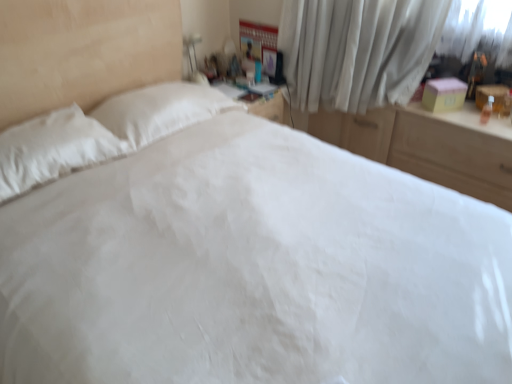
Identify the location of wooden dresser at right. The height and width of the screenshot is (384, 512). (426, 147).

The height and width of the screenshot is (384, 512). What do you see at coordinates (426, 147) in the screenshot? I see `wooden dresser at right` at bounding box center [426, 147].

I want to click on white sheer curtain at upper right, so 358,50.

This screenshot has width=512, height=384. What do you see at coordinates (358, 50) in the screenshot?
I see `white sheer curtain at upper right` at bounding box center [358, 50].

Identify the location of wooden dresser at right. The height and width of the screenshot is (384, 512). (426, 147).

Between white sheer curtain at upper right and wooden dresser at right, which one appears on the left side from the viewer's perspective?

white sheer curtain at upper right.

Is white sheer curtain at upper right closer to camera compared to wooden dresser at right?

No, it is behind wooden dresser at right.

Considering the positions of points (310, 29) and (452, 115), is point (310, 29) closer to camera compared to point (452, 115)?

No, it is not.

From the image's perspective, which one is positioned higher, white sheer curtain at upper right or wooden dresser at right?

white sheer curtain at upper right.

From the picture: From a real-world perspective, is white sheer curtain at upper right on wooden dresser at right?

Yes.

Consider the image. Is white sheer curtain at upper right wider or thinner than wooden dresser at right?

white sheer curtain at upper right is thinner than wooden dresser at right.

Can you confirm if white sheer curtain at upper right is shorter than wooden dresser at right?

No, white sheer curtain at upper right is not shorter than wooden dresser at right.

Between white sheer curtain at upper right and wooden dresser at right, which one has larger size?

Bigger between the two is wooden dresser at right.

From the picture: Is wooden dresser at right located within white sheer curtain at upper right?

That's incorrect, wooden dresser at right is not inside white sheer curtain at upper right.

Is white sheer curtain at upper right not near wooden dresser at right?

Actually, white sheer curtain at upper right and wooden dresser at right are a little close together.

Is white sheer curtain at upper right turned away from wooden dresser at right?

No, white sheer curtain at upper right is not facing the opposite direction of wooden dresser at right.

How different are the orientations of white sheer curtain at upper right and wooden dresser at right in degrees?

There is a 46.9-degree angle between the facing directions of white sheer curtain at upper right and wooden dresser at right.

How far apart are white sheer curtain at upper right and wooden dresser at right?

The distance of white sheer curtain at upper right from wooden dresser at right is 13.13 inches.

Identify the location of curtain on the left of wooden dresser at right. This screenshot has width=512, height=384. (358, 50).

In the image, is wooden dresser at right on the left side or the right side of white sheer curtain at upper right?

Based on their positions, wooden dresser at right is located to the right of white sheer curtain at upper right.

Consider the image. Does wooden dresser at right come behind white sheer curtain at upper right?

No, wooden dresser at right is in front of white sheer curtain at upper right.

Is point (316, 133) positioned behind point (419, 64)?

Yes, point (316, 133) is farther from viewer.

From the image's perspective, is wooden dresser at right above white sheer curtain at upper right?

No, from the image's perspective, wooden dresser at right is not on top of white sheer curtain at upper right.

From a real-world perspective, is wooden dresser at right on top of white sheer curtain at upper right?

Actually, wooden dresser at right is physically below white sheer curtain at upper right in the real world.

Which object is wider, wooden dresser at right or white sheer curtain at upper right?

wooden dresser at right is wider.

Is wooden dresser at right taller or shorter than white sheer curtain at upper right?

In the image, wooden dresser at right appears to be shorter than white sheer curtain at upper right.

Consider the image. Can you confirm if wooden dresser at right is bigger than white sheer curtain at upper right?

Indeed, wooden dresser at right has a larger size compared to white sheer curtain at upper right.

Is wooden dresser at right situated inside white sheer curtain at upper right or outside?

wooden dresser at right is not inside white sheer curtain at upper right, it's outside.

Is the surface of wooden dresser at right in direct contact with white sheer curtain at upper right?

No, wooden dresser at right is not beside white sheer curtain at upper right.

Is wooden dresser at right positioned with its back to white sheer curtain at upper right?

No, white sheer curtain at upper right is not at the back of wooden dresser at right.

Can you tell me how much wooden dresser at right and white sheer curtain at upper right differ in facing direction?

46.9 degrees.

Find the location of a particular element. This screenshot has height=384, width=512. dresser lying in front of the white sheer curtain at upper right is located at coordinates (426, 147).

The width and height of the screenshot is (512, 384). Find the location of `dresser in front of the white sheer curtain at upper right`. dresser in front of the white sheer curtain at upper right is located at coordinates click(x=426, y=147).

The width and height of the screenshot is (512, 384). What are the coordinates of `curtain above the wooden dresser at right (from the image's perspective)` in the screenshot? It's located at (358, 50).